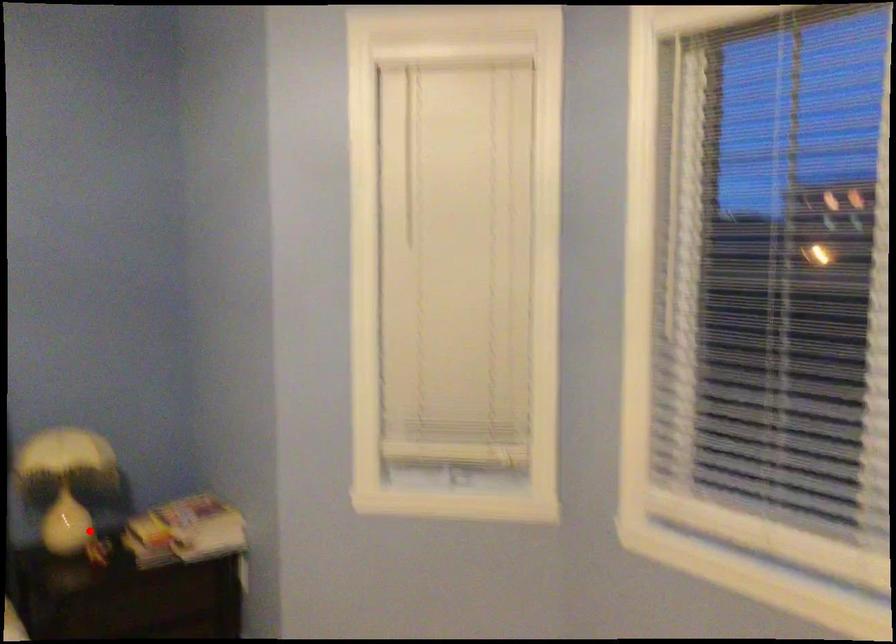
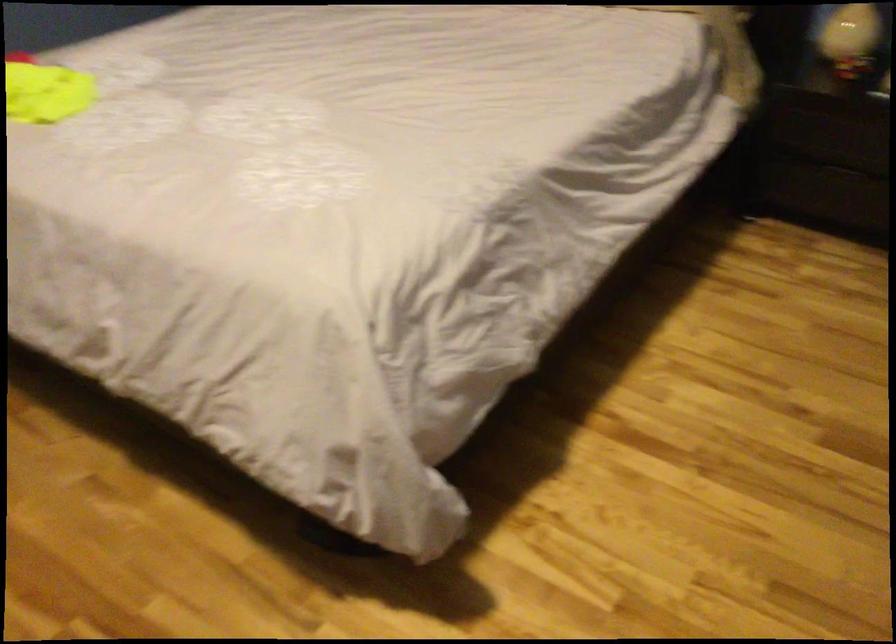
Question: I am providing you with two images of the same scene from different viewpoints. Given a red point in image1, look at the same physical point in image2. Is it:

Choices:
 (A) Closer to the viewpoint
 (B) Farther from the viewpoint

Answer: (A)